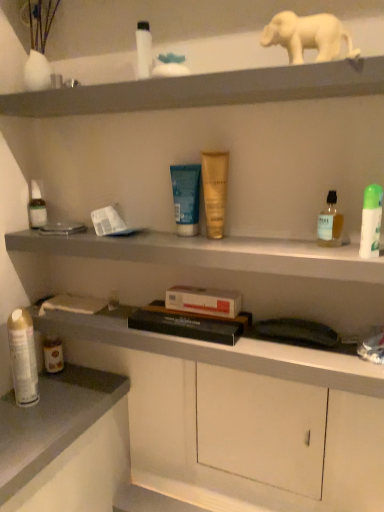
Where is `vacant area to the left of green plastic deodorant at right, which is counted as the first toiletry, starting from the front`? This screenshot has height=512, width=384. vacant area to the left of green plastic deodorant at right, which is counted as the first toiletry, starting from the front is located at coordinates (274, 251).